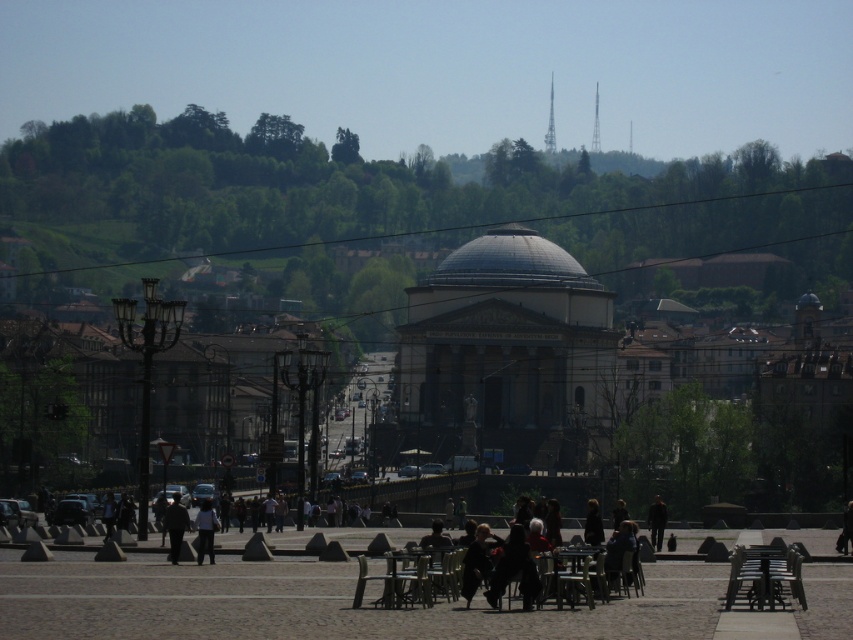
Which is more to the left, dark clothing at lower left or white cotton shirt at lower center?

Positioned to the left is dark clothing at lower left.

Does point (175, 541) lie behind point (204, 518)?

No, (175, 541) is in front of (204, 518).

Between point (178, 548) and point (207, 499), which one is positioned in front?

Point (178, 548) is in front.

The image size is (853, 640). What are the coordinates of `dark clothing at lower left` in the screenshot? It's located at (175, 525).

Between dark brown leather jacket at lower center and white cotton shirt at lower center, which one is positioned higher?

Positioned higher is dark brown leather jacket at lower center.

Does point (604, 580) come behind point (218, 524)?

No, (604, 580) is in front of (218, 524).

The image size is (853, 640). Identify the location of dark brown leather jacket at lower center. (511, 563).

Is white cotton shirt at lower center wider than dark gray jacket at lower center?

No, white cotton shirt at lower center is not wider than dark gray jacket at lower center.

In the scene shown: How far apart are white cotton shirt at lower center and dark gray jacket at lower center?

white cotton shirt at lower center and dark gray jacket at lower center are 10.20 meters apart.

Where is `white cotton shirt at lower center`? white cotton shirt at lower center is located at coordinates (206, 531).